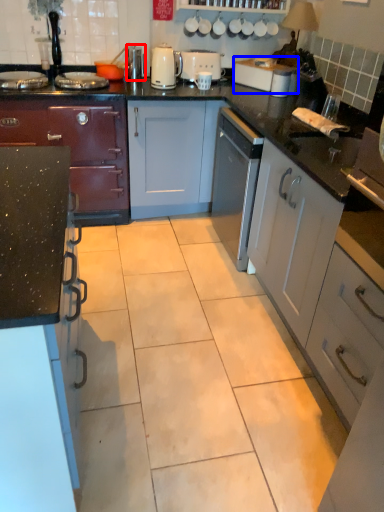
Question: Which point is further to the camera, appliance (highlighted by a red box) or toaster (highlighted by a blue box)?

Choices:
 (A) appliance
 (B) toaster

Answer: (A)